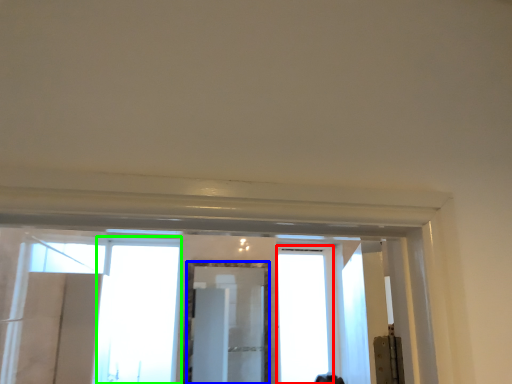
Question: Which object is the farthest from window (highlighted by a red box)? Choose among these: mirror (highlighted by a blue box) or window (highlighted by a green box).

Choices:
 (A) mirror
 (B) window

Answer: (B)